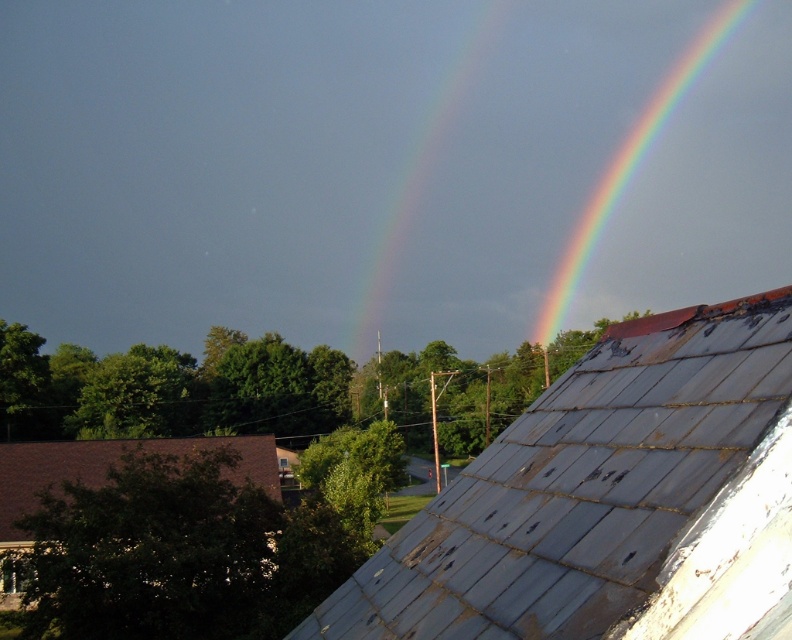
Question: Can you confirm if brown shingles at lower left is positioned below rainbow at upper right?

Choices:
 (A) no
 (B) yes

Answer: (B)

Question: Which object appears farthest from the camera in this image?

Choices:
 (A) rusty metal roof at upper right
 (B) rainbow at upper right
 (C) brown shingles at lower left

Answer: (B)

Question: Which point appears farthest from the camera in this image?

Choices:
 (A) (42, 458)
 (B) (419, 600)

Answer: (A)

Question: Is rusty metal roof at upper right bigger than rainbow at upper right?

Choices:
 (A) yes
 (B) no

Answer: (B)

Question: Can you confirm if rusty metal roof at upper right is bigger than brown shingles at lower left?

Choices:
 (A) no
 (B) yes

Answer: (A)

Question: Which object is farther from the camera taking this photo?

Choices:
 (A) rainbow at upper right
 (B) rusty metal roof at upper right

Answer: (A)